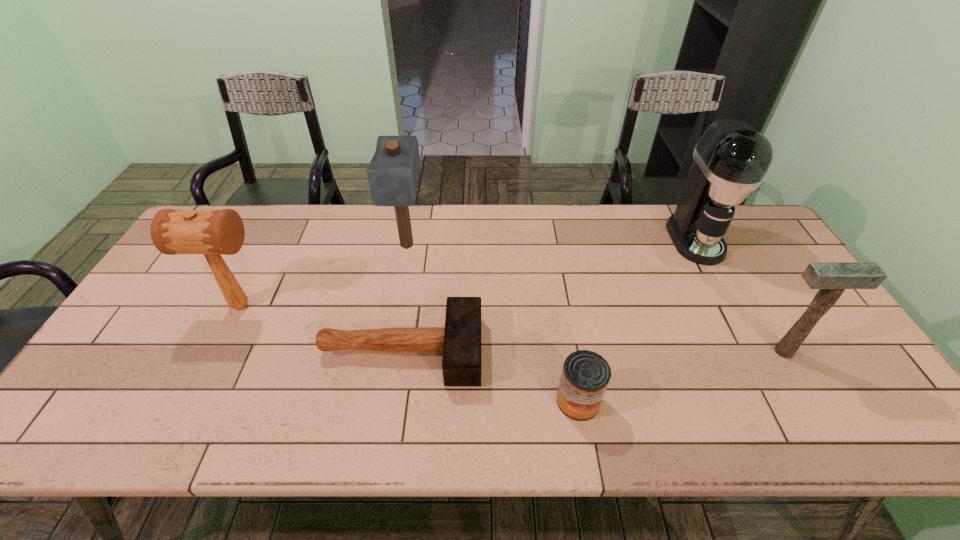
Locate an element on the screen. This screenshot has height=540, width=960. coffee maker is located at coordinates 731,159.

This screenshot has width=960, height=540. In order to click on the farthest mallet in this screenshot , I will do `click(393, 172)`.

Find the location of `the leftmost object`. the leftmost object is located at coordinates (210, 232).

This screenshot has height=540, width=960. Find the location of `the rightmost mallet`. the rightmost mallet is located at coordinates (832, 278).

This screenshot has height=540, width=960. What are the coordinates of `the third object from right to left` in the screenshot? It's located at (585, 376).

Where is `the second shortest object`? Image resolution: width=960 pixels, height=540 pixels. the second shortest object is located at coordinates (585, 376).

The width and height of the screenshot is (960, 540). I want to click on the shortest object, so click(460, 340).

Where is `vacant space located 0.100m place cup under the spout of the coffee maker`? vacant space located 0.100m place cup under the spout of the coffee maker is located at coordinates (722, 289).

Locate an element on the screen. free region located 0.150m on the right of the farthest mallet is located at coordinates (472, 246).

Where is `free space located on the strike surface of the leftmost object`? The image size is (960, 540). free space located on the strike surface of the leftmost object is located at coordinates (359, 305).